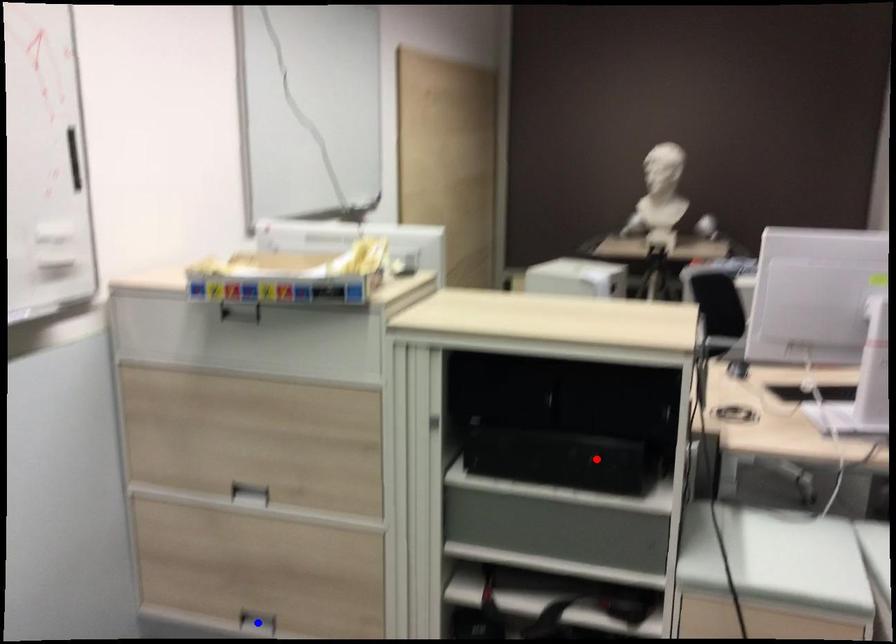
Question: Which of the two points in the image is closer to the camera?

Choices:
 (A) Blue point is closer.
 (B) Red point is closer.

Answer: (B)